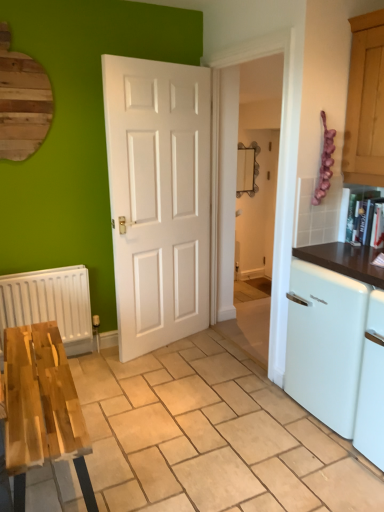
The height and width of the screenshot is (512, 384). Identify the location of free spot above wooden table at lower left (from a real-world perspective). (211, 402).